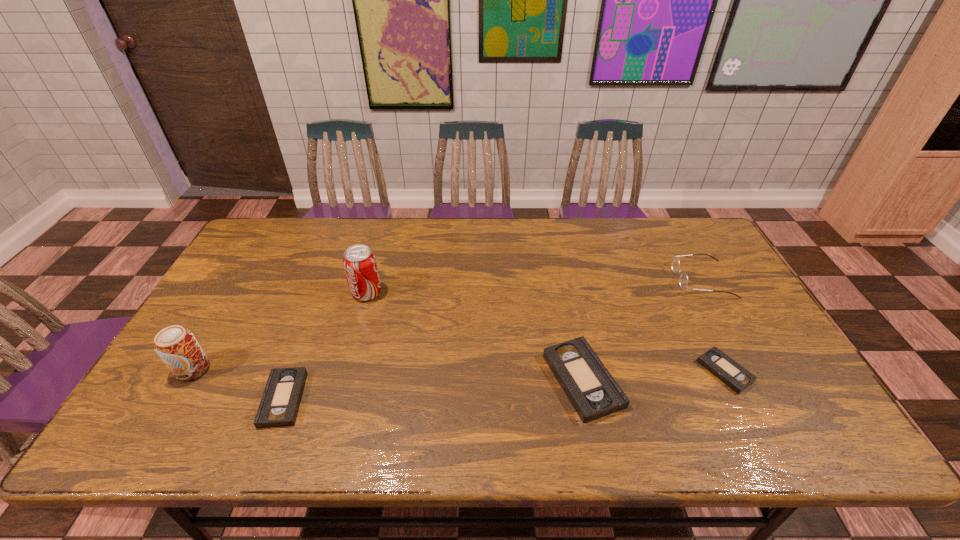
This screenshot has height=540, width=960. Find the location of `the second shortest object`. the second shortest object is located at coordinates (278, 407).

Find the location of `the second shortest videotape`. the second shortest videotape is located at coordinates (278, 407).

This screenshot has width=960, height=540. In order to click on the third shortest object in this screenshot , I will do `click(591, 389)`.

Locate an element on the screen. the third object from right to left is located at coordinates click(x=591, y=389).

Locate an element on the screen. This screenshot has width=960, height=540. the shortest videotape is located at coordinates (736, 377).

The height and width of the screenshot is (540, 960). I want to click on the rightmost videotape, so click(x=736, y=377).

Identify the location of the third object from left to right. (359, 262).

Identify the location of the tallest object. (359, 262).

At what (x,y) coordinates should I click in order to perform the action: click on the third tallest object. Please return your answer as a coordinate pair (x, y). Looking at the image, I should click on (683, 280).

The height and width of the screenshot is (540, 960). I want to click on beer can, so click(177, 347).